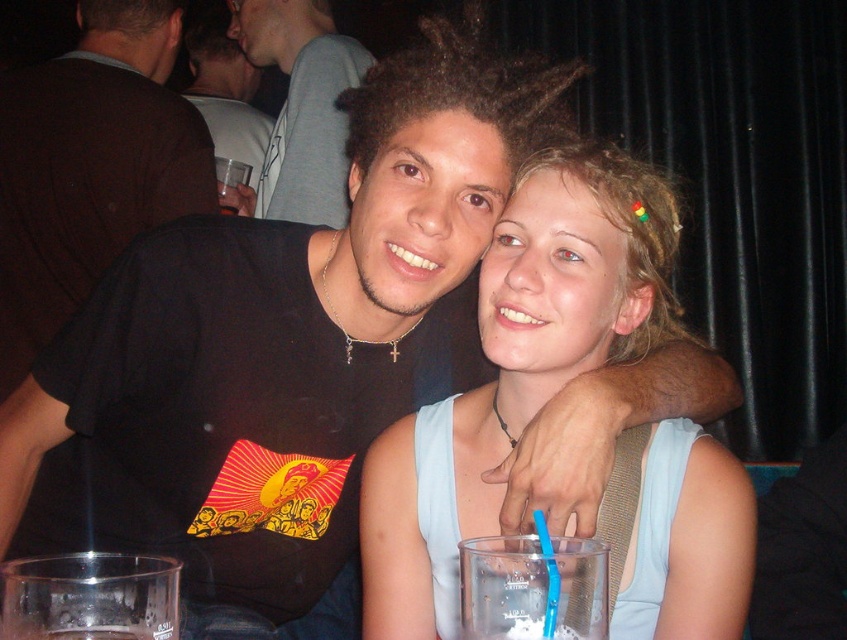
This screenshot has height=640, width=847. Describe the element at coordinates (515, 369) in the screenshot. I see `light blue fabric dress at center` at that location.

Does light blue fabric dress at center have a lesser width compared to black matte t-shirt at upper left?

Yes, light blue fabric dress at center is thinner than black matte t-shirt at upper left.

The width and height of the screenshot is (847, 640). What do you see at coordinates (515, 369) in the screenshot? I see `light blue fabric dress at center` at bounding box center [515, 369].

You are a GUI agent. You are given a task and a screenshot of the screen. Output one action in this format:
    pyautogui.click(x=<x>, y=<y>)
    Task: Click on the light blue fabric dress at center
    Image resolution: width=847 pixels, height=640 pixels.
    Given the screenshot: What is the action you would take?
    pyautogui.click(x=515, y=369)

Between point (573, 164) and point (350, 48), which one is positioned behind?

Positioned behind is point (350, 48).

Can you confirm if light blue fabric dress at center is taller than black t-shirt at center?

No, light blue fabric dress at center is not taller than black t-shirt at center.

The height and width of the screenshot is (640, 847). What do you see at coordinates (515, 369) in the screenshot?
I see `light blue fabric dress at center` at bounding box center [515, 369].

Where is `light blue fabric dress at center`? Image resolution: width=847 pixels, height=640 pixels. light blue fabric dress at center is located at coordinates (515, 369).

Who is higher up, black matte t-shirt at upper left or black t-shirt at center?

black t-shirt at center is higher up.

From the picture: Does black matte t-shirt at upper left appear on the right side of black t-shirt at center?

In fact, black matte t-shirt at upper left is to the left of black t-shirt at center.

Locate an element on the screen. This screenshot has height=640, width=847. black matte t-shirt at upper left is located at coordinates tap(90, 166).